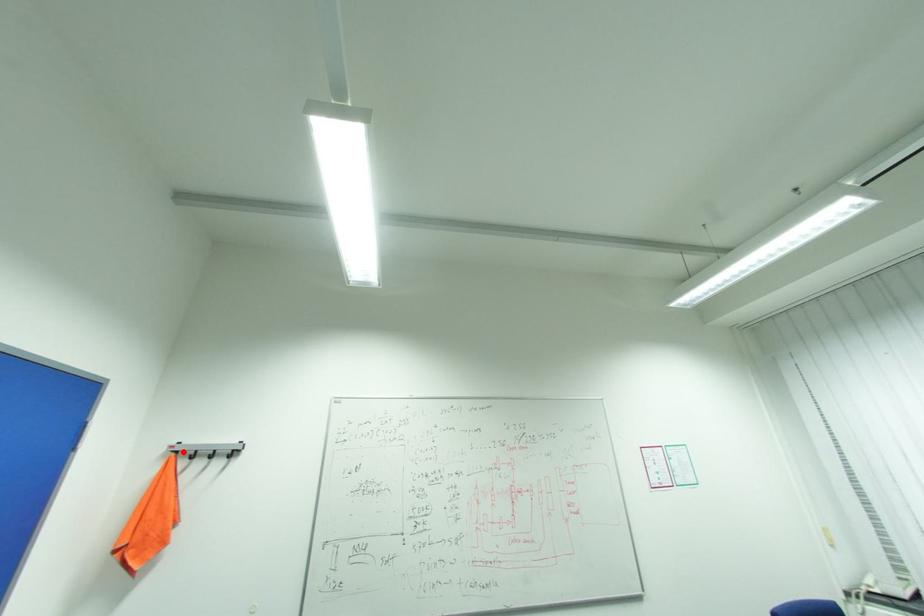
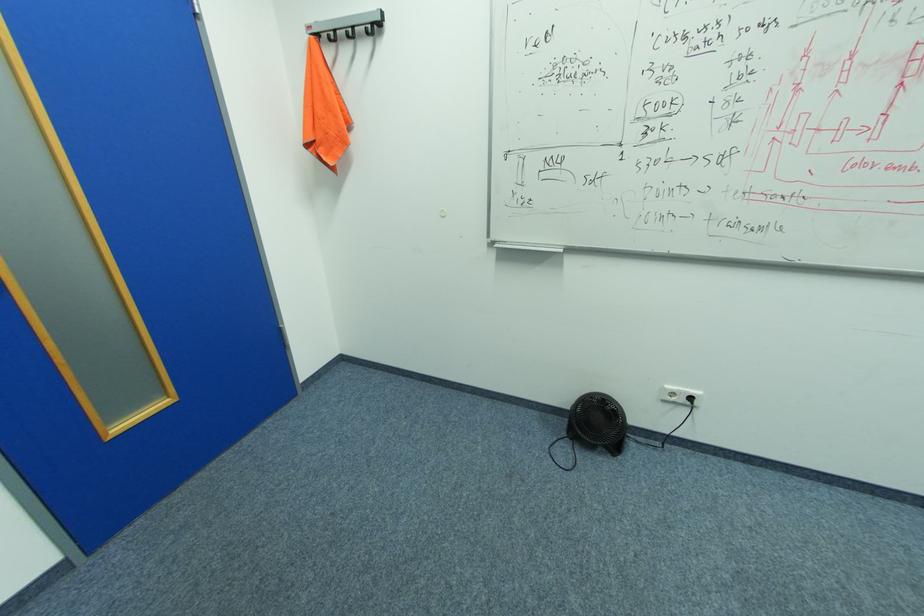
In the second image, find the point that corresponds to the highlighted location in the first image.

(324, 34)